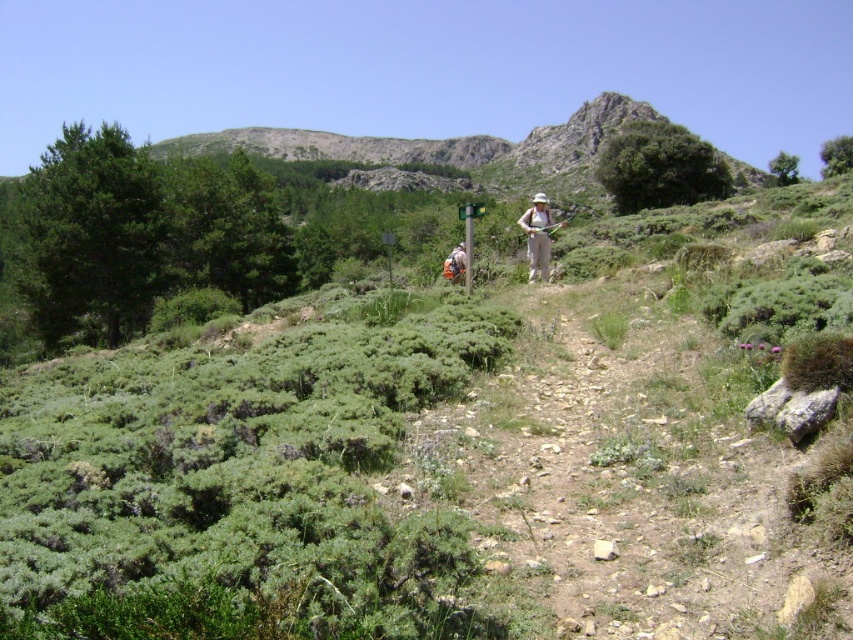
Question: Which point appears closest to the camera in this image?

Choices:
 (A) (451, 266)
 (B) (529, 221)

Answer: (B)

Question: Does green leafy shrubbery at center have a larger size compared to camouflage fabric backpack at center?

Choices:
 (A) no
 (B) yes

Answer: (B)

Question: Does green leafy shrubbery at center have a lesser width compared to khaki pants at center?

Choices:
 (A) no
 (B) yes

Answer: (A)

Question: Which point is closer to the camera?

Choices:
 (A) (457, 256)
 (B) (714, 550)
 (C) (534, 198)

Answer: (B)

Question: Which point is farther from the camera taking this photo?

Choices:
 (A) (456, 248)
 (B) (531, 260)

Answer: (A)

Question: Is green leafy shrubbery at center in front of camouflage fabric backpack at center?

Choices:
 (A) no
 (B) yes

Answer: (B)